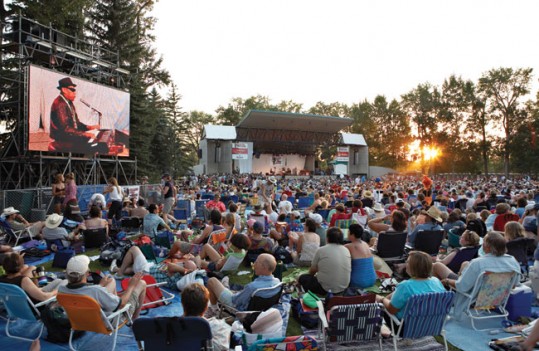
The image size is (539, 351). What are the coordinates of `towel or blanket on the ground` in the screenshot? It's located at (464, 341).